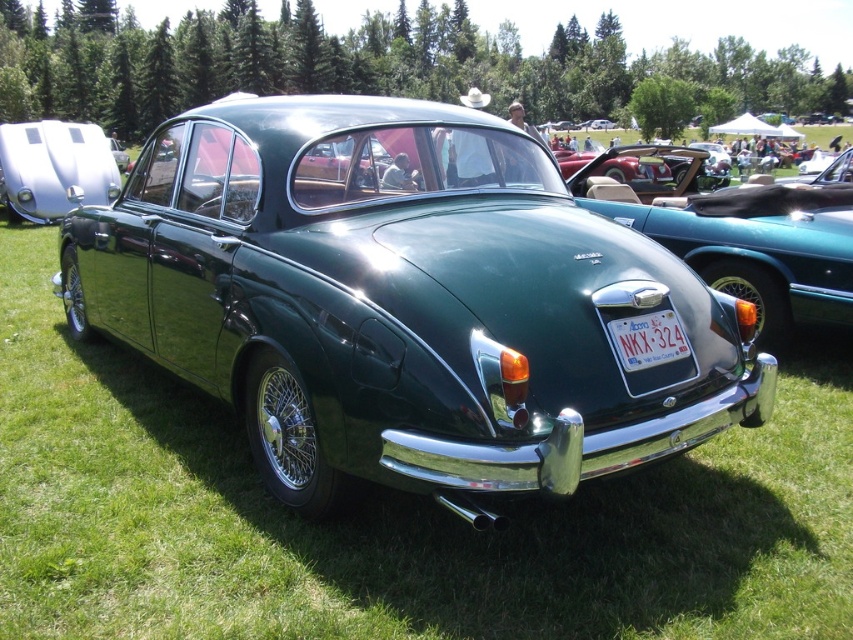
Question: Is shiny white car at left smaller than white plastic license plate at center?

Choices:
 (A) no
 (B) yes

Answer: (A)

Question: Is shiny white car at left to the left of white plastic license plate at center from the viewer's perspective?

Choices:
 (A) no
 (B) yes

Answer: (B)

Question: Which object appears closest to the camera in this image?

Choices:
 (A) white plastic license plate at center
 (B) shiny white car at left

Answer: (A)

Question: Which of the following is the farthest from the observer?

Choices:
 (A) shiny white car at left
 (B) white plastic license plate at center

Answer: (A)

Question: Is shiny white car at left positioned in front of white plastic license plate at center?

Choices:
 (A) yes
 (B) no

Answer: (B)